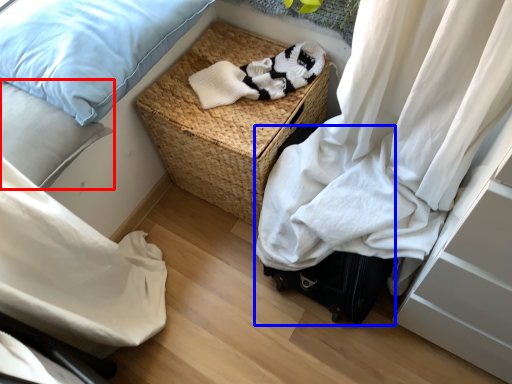
Question: Which object is further to the camera taking this photo, pillow (highlighted by a red box) or luggage (highlighted by a blue box)?

Choices:
 (A) pillow
 (B) luggage

Answer: (B)